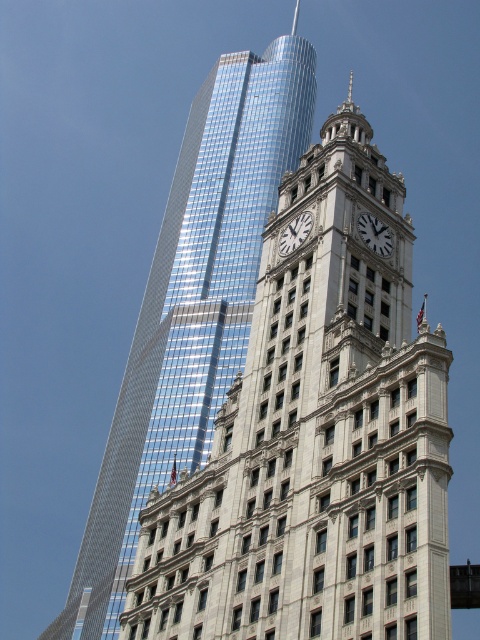
Between white marble clock at upper center and white stone clock at upper center, which one is positioned lower?

white marble clock at upper center is lower down.

Which is more to the left, white marble clock at upper center or white stone clock at upper center?

white stone clock at upper center

Does point (382, 225) come behind point (284, 232)?

No.

The width and height of the screenshot is (480, 640). I want to click on white marble clock at upper center, so click(374, 234).

This screenshot has height=640, width=480. Describe the element at coordinates (192, 305) in the screenshot. I see `shiny glass skyscraper at upper left` at that location.

Which is above, shiny glass skyscraper at upper left or white stone clock at upper center?

shiny glass skyscraper at upper left is higher up.

Does point (235, 269) come behind point (288, 243)?

Yes, point (235, 269) is farther from viewer.

Locate an element on the screen. Image resolution: width=480 pixels, height=640 pixels. shiny glass skyscraper at upper left is located at coordinates (192, 305).

In the scene shown: Can you confirm if reflective glass skyscraper at upper left is smaller than white stone clock at upper center?

Incorrect, reflective glass skyscraper at upper left is not smaller in size than white stone clock at upper center.

Does reflective glass skyscraper at upper left appear under white stone clock at upper center?

No.

Is point (402, 394) less distant than point (311, 221)?

That is True.

At what (x,y) coordinates should I click in order to perform the action: click on reflective glass skyscraper at upper left. Please return your answer as a coordinate pair (x, y). Looking at the image, I should click on (315, 440).